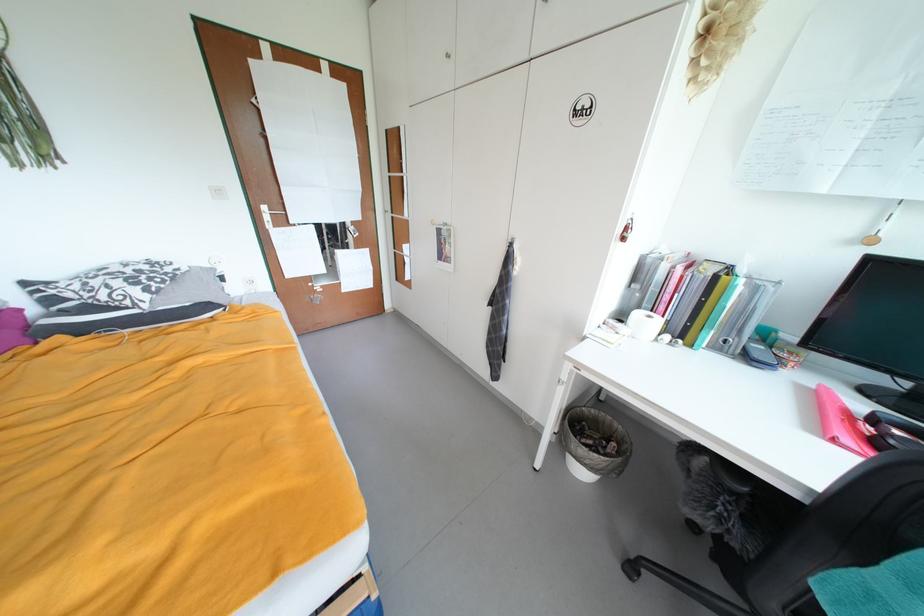
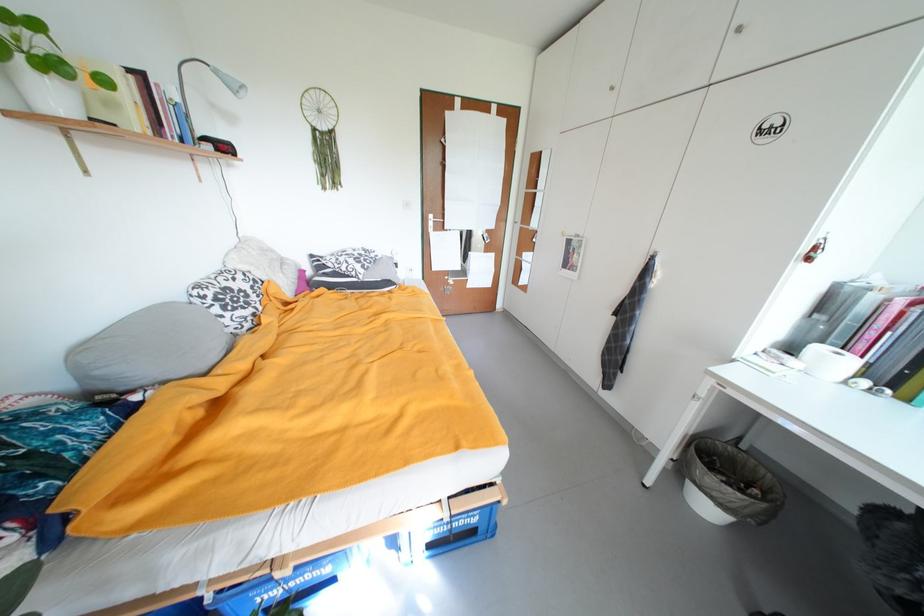
Where in the second image is the point corresponding to point 273,209 from the first image?

(439, 217)